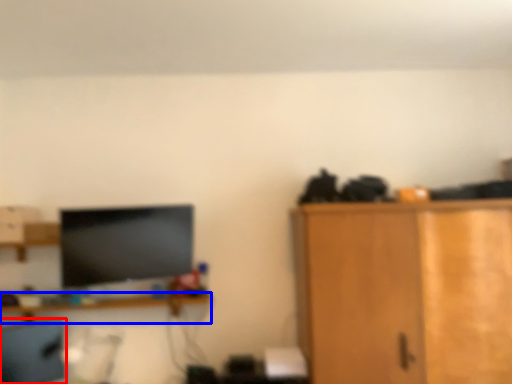
Question: Which point is closer to the camera, computer chair (highlighted by a red box) or shelf (highlighted by a blue box)?

Choices:
 (A) computer chair
 (B) shelf

Answer: (A)